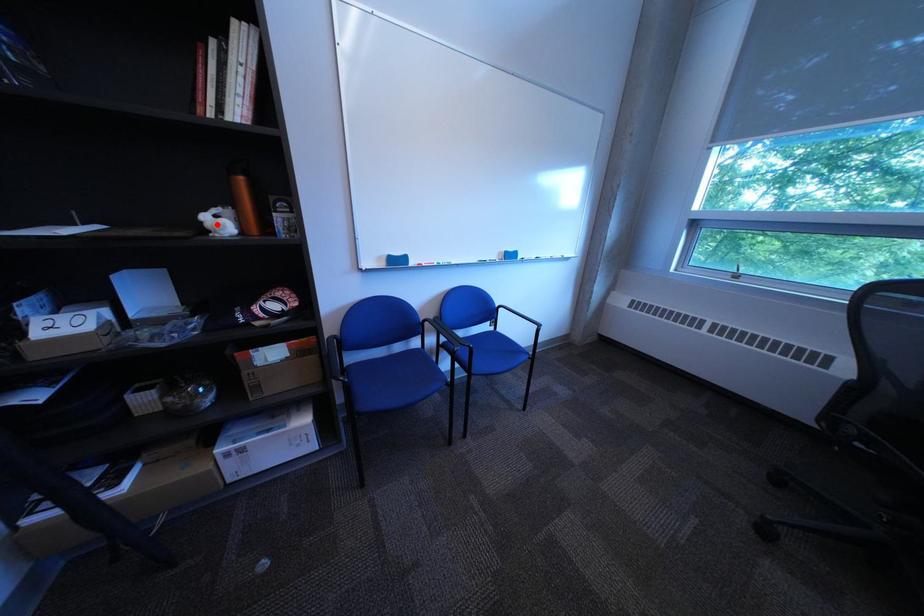
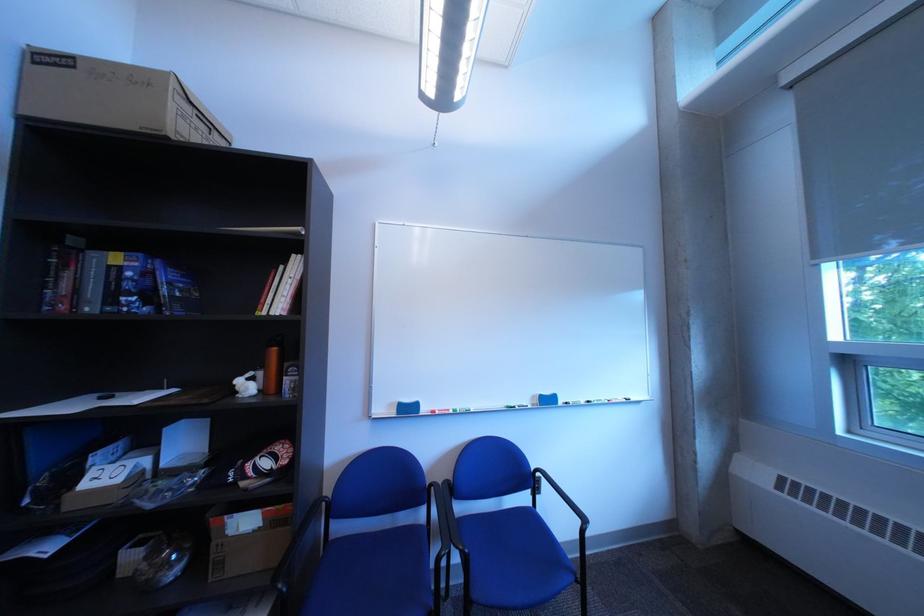
In the second image, find the point that corresponds to the highlighted location in the first image.

(249, 387)